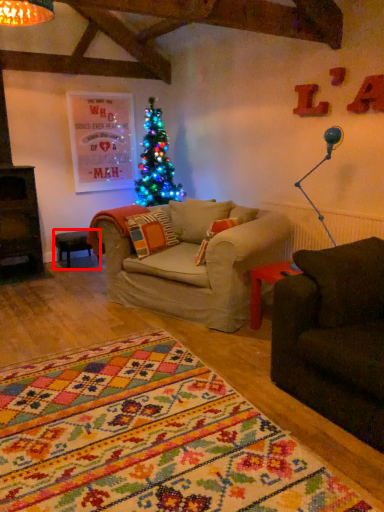
Question: From the image, what is the correct spatial relationship of table (annotated by the red box) in relation to lamp?

Choices:
 (A) right
 (B) left

Answer: (B)